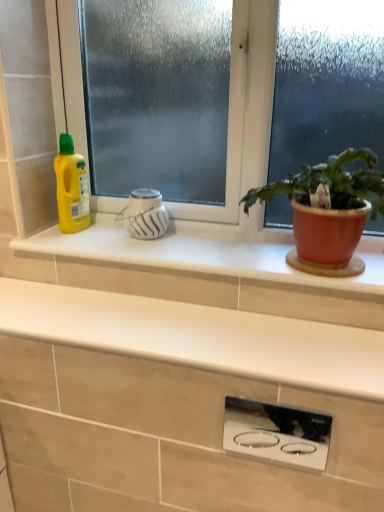
Image resolution: width=384 pixels, height=512 pixels. In order to click on vacant region above white matte countertop at center (from a real-world perspective) in this screenshot , I will do `click(152, 319)`.